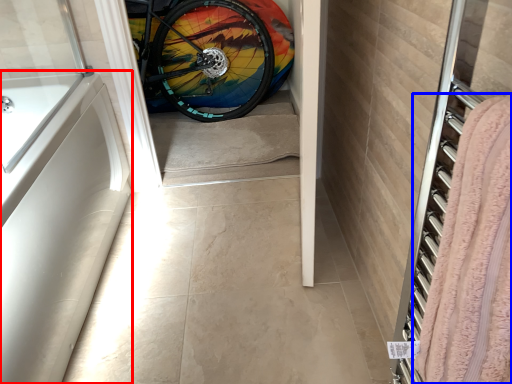
Question: Which of the following is the closest to the observer, bath (highlighted by a red box) or blanket (highlighted by a blue box)?

Choices:
 (A) bath
 (B) blanket

Answer: (B)